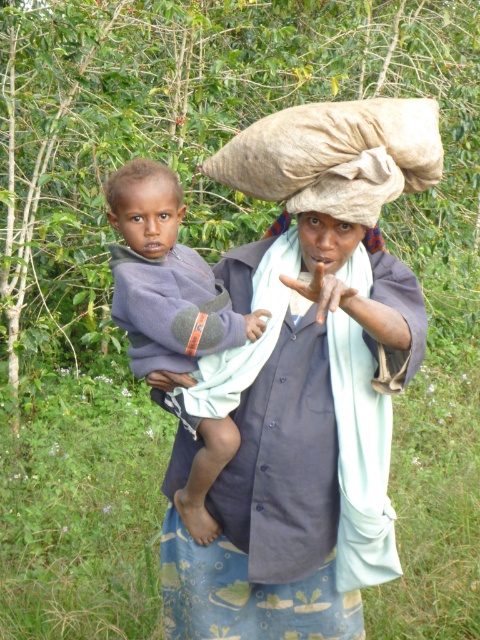
Can you confirm if dark gray fleece at center is thinner than dark brown skin at center?

Incorrect, dark gray fleece at center's width is not less than dark brown skin at center's.

Is point (149, 288) positioned before point (137, 179)?

Yes, point (149, 288) is in front of point (137, 179).

Is point (127, 307) positioned in front of point (177, 182)?

Yes, point (127, 307) is in front of point (177, 182).

This screenshot has height=640, width=480. Identify the location of dark gray fleece at center. (165, 276).

Which is in front, point (327, 508) or point (135, 243)?

Point (135, 243)

Between blue fabric at center and dark brown skin at center, which one is positioned lower?

blue fabric at center is below.

Is point (324, 435) positioned in front of point (144, 173)?

That is False.

Locate an element on the screen. blue fabric at center is located at coordinates (289, 461).

Can you confirm if blue fabric at center is thinner than dark gray fleece at center?

No.

Which of these two, blue fabric at center or dark gray fleece at center, stands taller?

Standing taller between the two is blue fabric at center.

Is point (315, 579) positioned before point (157, 170)?

No.

Locate an element on the screen. This screenshot has height=640, width=480. blue fabric at center is located at coordinates (289, 461).